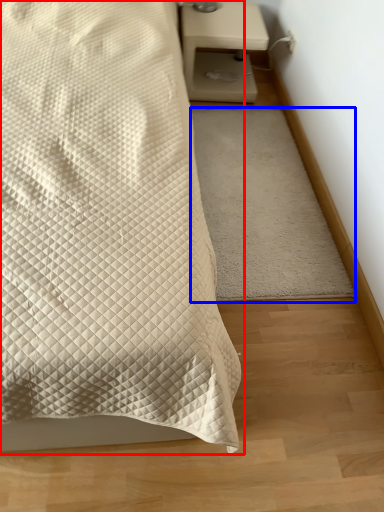
Question: Which of the following is the farthest to the observer, bed (highlighted by a red box) or mat (highlighted by a blue box)?

Choices:
 (A) bed
 (B) mat

Answer: (B)